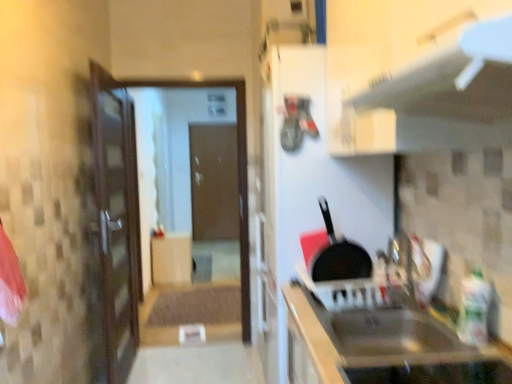
Where is `transparent glass door at center`? transparent glass door at center is located at coordinates (154, 183).

Based on the photo, measure the distance between point (369,265) and camera.

Point (369,265) and camera are 1.73 meters apart.

What do you see at coordinates (439, 98) in the screenshot?
I see `metallic gray exhaust hood at upper center` at bounding box center [439, 98].

This screenshot has width=512, height=384. What are the coordinates of `transparent glass door at center` in the screenshot? It's located at (154, 183).

From a real-world perspective, starting from the transparent glass door at center, which cabinetry is the 1st one below it? Please provide its 2D coordinates.

[(388, 346)]

Considering the relative positions of transparent glass door at center and metallic stainless steel sink at lower right, which appears as the first cabinetry when viewed from the right, in the image provided, is transparent glass door at center behind metallic stainless steel sink at lower right, which appears as the first cabinetry when viewed from the right,?

Yes, transparent glass door at center is behind metallic stainless steel sink at lower right, which appears as the first cabinetry when viewed from the right.

How different are the orientations of transparent glass door at center and metallic stainless steel sink at lower right, which appears as the first cabinetry when viewed from the right, in degrees?

The angular difference between transparent glass door at center and metallic stainless steel sink at lower right, which appears as the first cabinetry when viewed from the right, is 90.6 degrees.

From the image's perspective, which one is positioned higher, transparent glass door at center or metallic stainless steel sink at lower right, which appears as the first cabinetry when viewed from the right?

transparent glass door at center.

Is matte wood cabinet at center, marked as the 1th cabinetry in a left-to-right arrangement, at the left side of black matte frying pan at center?

Indeed, matte wood cabinet at center, marked as the 1th cabinetry in a left-to-right arrangement, is positioned on the left side of black matte frying pan at center.

Can you confirm if matte wood cabinet at center, arranged as the second cabinetry when viewed from the right, is shorter than black matte frying pan at center?

In fact, matte wood cabinet at center, arranged as the second cabinetry when viewed from the right, may be taller than black matte frying pan at center.

Which is behind, matte wood cabinet at center, marked as the 1th cabinetry in a left-to-right arrangement, or black matte frying pan at center?

matte wood cabinet at center, marked as the 1th cabinetry in a left-to-right arrangement, is further from the camera.

Choose the correct answer: Is matte wood cabinet at center, the 1th cabinetry positioned from the back, inside brown matte door at center or outside it?

matte wood cabinet at center, the 1th cabinetry positioned from the back, lies outside brown matte door at center.

Identify the location of door on the right of matte wood cabinet at center, arranged as the second cabinetry when viewed from the right. This screenshot has height=384, width=512. pos(214,182).

Can you confirm if matte wood cabinet at center, marked as the 1th cabinetry in a left-to-right arrangement, is positioned to the left of brown matte door at center?

Yes, matte wood cabinet at center, marked as the 1th cabinetry in a left-to-right arrangement, is to the left of brown matte door at center.

Consider the image. Based on their sizes in the image, would you say matte wood cabinet at center, the 1th cabinetry positioned from the back, is bigger or smaller than brown matte door at center?

matte wood cabinet at center, the 1th cabinetry positioned from the back, is smaller than brown matte door at center.

In the image, is brown matte door at center positioned in front of or behind black matte frying pan at center?

Visually, brown matte door at center is located behind black matte frying pan at center.

Between brown matte door at center and black matte frying pan at center, which one has smaller width?

black matte frying pan at center is thinner.

Is brown matte door at center oriented towards black matte frying pan at center?

Yes, brown matte door at center is turned towards black matte frying pan at center.

From the image's perspective, is brown matte door at center located above or below black matte frying pan at center?

brown matte door at center is above black matte frying pan at center.

Consider the image. Is metallic gray exhaust hood at upper center aimed at brown matte door at center?

No, metallic gray exhaust hood at upper center is not aimed at brown matte door at center.

From the image's perspective, is metallic gray exhaust hood at upper center beneath brown matte door at center?

Incorrect, from the image's perspective, metallic gray exhaust hood at upper center is higher than brown matte door at center.

Is metallic gray exhaust hood at upper center behind brown matte door at center?

No, it is in front of brown matte door at center.

Considering the points (415, 146) and (213, 238), which point is in front, point (415, 146) or point (213, 238)?

The point (415, 146) is in front.

From the image's perspective, which one is positioned lower, brown matte door at center or metallic stainless steel sink at lower right, which is counted as the 1th cabinetry, starting from the front?

metallic stainless steel sink at lower right, which is counted as the 1th cabinetry, starting from the front, appears lower in the image.

Would you say brown matte door at center is outside metallic stainless steel sink at lower right, the second cabinetry positioned from the left?

brown matte door at center is positioned outside metallic stainless steel sink at lower right, the second cabinetry positioned from the left.

From a real-world perspective, is brown matte door at center physically located above or below metallic stainless steel sink at lower right, the second cabinetry positioned from the left?

Clearly, from a real-world perspective, brown matte door at center is above metallic stainless steel sink at lower right, the second cabinetry positioned from the left.

Is brown matte door at center aimed at metallic stainless steel sink at lower right, which ranks as the second cabinetry in back-to-front order?

Yes, brown matte door at center faces towards metallic stainless steel sink at lower right, which ranks as the second cabinetry in back-to-front order.

Who is bigger, metallic gray exhaust hood at upper center or metallic stainless steel sink at lower right, which appears as the first cabinetry when viewed from the right?

metallic gray exhaust hood at upper center.

Consider the image. Can you confirm if metallic gray exhaust hood at upper center is thinner than metallic stainless steel sink at lower right, which appears as the first cabinetry when viewed from the right?

Incorrect, the width of metallic gray exhaust hood at upper center is not less than that of metallic stainless steel sink at lower right, which appears as the first cabinetry when viewed from the right.

From a real-world perspective, is metallic gray exhaust hood at upper center on metallic stainless steel sink at lower right, the second cabinetry positioned from the left?

Yes, from a real-world perspective, metallic gray exhaust hood at upper center is above metallic stainless steel sink at lower right, the second cabinetry positioned from the left.

From the image's perspective, starting from the transparent glass door at center, which cabinetry is the 1st one below? Please provide its 2D coordinates.

[(388, 346)]

Identify the location of frying pan above the matte wood cabinet at center, arranged as the second cabinetry when viewed from the right (from a real-world perspective). This screenshot has width=512, height=384. (339, 256).

Based on their spatial positions, is metallic gray exhaust hood at upper center or black matte frying pan at center closer to brown matte door at center?

black matte frying pan at center.

Considering their positions, is brown matte door at center positioned closer to matte wood cabinet at center, the 1th cabinetry positioned from the back, than metallic stainless steel sink at lower right, which ranks as the second cabinetry in back-to-front order?

Among the two, brown matte door at center is located nearer to matte wood cabinet at center, the 1th cabinetry positioned from the back.

Considering their positions, is matte wood cabinet at center, marked as the 1th cabinetry in a left-to-right arrangement, positioned further to metallic gray exhaust hood at upper center than brown matte door at center?

Based on the image, brown matte door at center appears to be further to metallic gray exhaust hood at upper center.

Estimate the real-world distances between objects in this image. Which object is closer to matte wood cabinet at center, positioned as the second cabinetry in front-to-back order, metallic stainless steel sink at lower right, which ranks as the second cabinetry in back-to-front order, or black matte frying pan at center?

black matte frying pan at center is positioned closer to the anchor matte wood cabinet at center, positioned as the second cabinetry in front-to-back order.

Estimate the real-world distances between objects in this image. Which object is closer to brown matte door at center, metallic stainless steel sink at lower right, the second cabinetry positioned from the left, or metallic gray exhaust hood at upper center?

The object closer to brown matte door at center is metallic stainless steel sink at lower right, the second cabinetry positioned from the left.

Looking at the image, which one is located further to metallic stainless steel sink at lower right, which is counted as the 1th cabinetry, starting from the front, transparent glass door at center or black matte frying pan at center?

transparent glass door at center is further to metallic stainless steel sink at lower right, which is counted as the 1th cabinetry, starting from the front.

Which object lies further to the anchor point metallic stainless steel sink at lower right, which appears as the first cabinetry when viewed from the right, black matte frying pan at center or transparent glass door at center?

transparent glass door at center.

Looking at the image, which one is located further to metallic gray exhaust hood at upper center, transparent glass door at center or metallic stainless steel sink at lower right, the second cabinetry positioned from the left?

transparent glass door at center.

At what (x,y) coordinates should I click in order to perform the action: click on screen door between metallic gray exhaust hood at upper center and brown matte door at center along the z-axis. Please return your answer as a coordinate pair (x, y). This screenshot has width=512, height=384. Looking at the image, I should click on (154, 183).

Find the location of a particular element. cabinetry between metallic stainless steel sink at lower right, which appears as the first cabinetry when viewed from the right, and brown matte door at center in the front-back direction is located at coordinates [x=170, y=258].

This screenshot has width=512, height=384. I want to click on cabinetry positioned between metallic gray exhaust hood at upper center and transparent glass door at center from near to far, so click(388, 346).

In order to click on frying pan between metallic gray exhaust hood at upper center and matte wood cabinet at center, arranged as the second cabinetry when viewed from the right, in the front-back direction in this screenshot , I will do `click(339, 256)`.